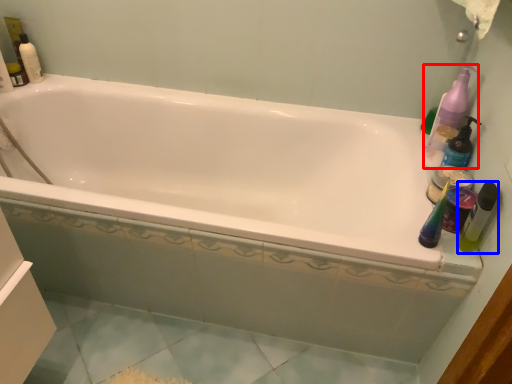
Question: Which object appears closest to the camera in this image, cleaning product (highlighted by a red box) or mouthwash (highlighted by a blue box)?

Choices:
 (A) cleaning product
 (B) mouthwash

Answer: (B)